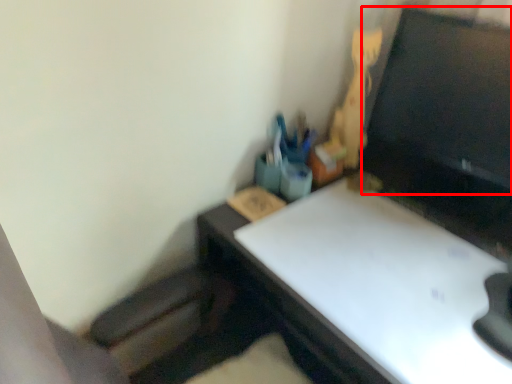
Question: In this image, where is computer monitor (annotated by the red box) located relative to toy?

Choices:
 (A) left
 (B) right

Answer: (B)